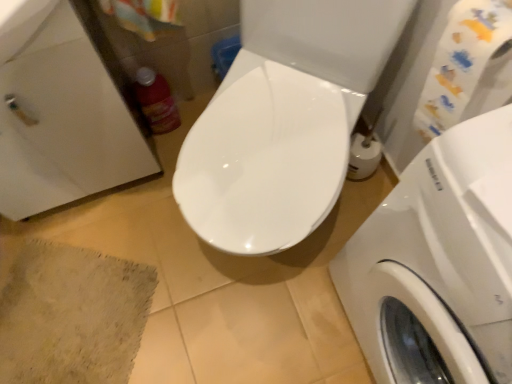
Describe the element at coordinates (72, 315) in the screenshot. The height and width of the screenshot is (384, 512). I see `beige textured bath mat at lower left` at that location.

The width and height of the screenshot is (512, 384). What do you see at coordinates (438, 263) in the screenshot?
I see `white glossy washing machine at right` at bounding box center [438, 263].

The width and height of the screenshot is (512, 384). Identify the location of matte plastic bottle at left. (156, 101).

Can you confirm if beige textured bath mat at lower left is shorter than matte plastic bottle at left?

Correct, beige textured bath mat at lower left is not as tall as matte plastic bottle at left.

Is beige textured bath mat at lower left oriented towards matte plastic bottle at left?

No, beige textured bath mat at lower left is not facing towards matte plastic bottle at left.

Looking at the image, does beige textured bath mat at lower left seem bigger or smaller compared to matte plastic bottle at left?

beige textured bath mat at lower left is bigger than matte plastic bottle at left.

Is point (59, 331) farther from camera compared to point (152, 84)?

No, it is not.

From a real-world perspective, is matte plastic bottle at left physically located above or below white glossy sink at upper left?

Clearly, from a real-world perspective, matte plastic bottle at left is below white glossy sink at upper left.

Is matte plastic bottle at left at the right side of white glossy sink at upper left?

Yes.

Is matte plastic bottle at left further to camera compared to white glossy sink at upper left?

Yes, matte plastic bottle at left is behind white glossy sink at upper left.

Is white glossy sink at upper left completely or partially inside matte plastic bottle at left?

No, white glossy sink at upper left is not a part of matte plastic bottle at left.

From the image's perspective, is matte plastic bottle at left above or below white glossy washing machine at right?

Clearly, from the image's perspective, matte plastic bottle at left is above white glossy washing machine at right.

From a real-world perspective, between matte plastic bottle at left and white glossy washing machine at right, who is vertically lower?

matte plastic bottle at left.

How far apart are matte plastic bottle at left and white glossy washing machine at right?

They are 32.87 inches apart.

Is matte plastic bottle at left looking in the opposite direction of white glossy washing machine at right?

No, matte plastic bottle at left is not facing the opposite direction of white glossy washing machine at right.

Between white glossy washing machine at right and matte plastic bottle at left, which one has larger size?

white glossy washing machine at right.

Is point (500, 195) behind point (148, 104)?

No, (500, 195) is closer to viewer.

Considering the sizes of white glossy washing machine at right and matte plastic bottle at left in the image, is white glossy washing machine at right taller or shorter than matte plastic bottle at left?

In the image, white glossy washing machine at right appears to be taller than matte plastic bottle at left.

Would you say white glossy washing machine at right is inside or outside matte plastic bottle at left?

white glossy washing machine at right is spatially situated outside matte plastic bottle at left.

Is white glossy sink at upper left oriented away from matte plastic bottle at left?

That's not correct — white glossy sink at upper left is not looking away from matte plastic bottle at left.

Considering the sizes of white glossy sink at upper left and matte plastic bottle at left in the image, is white glossy sink at upper left bigger or smaller than matte plastic bottle at left?

In the image, white glossy sink at upper left appears to be larger than matte plastic bottle at left.

Which object is positioned more to the right, white glossy sink at upper left or matte plastic bottle at left?

matte plastic bottle at left.

Would you say white glossy sink at upper left is a long distance from matte plastic bottle at left?

No, white glossy sink at upper left is not far away from matte plastic bottle at left.

Is matte plastic bottle at left spatially inside beige textured bath mat at lower left, or outside of it?

matte plastic bottle at left cannot be found inside beige textured bath mat at lower left.

Considering the relative sizes of matte plastic bottle at left and beige textured bath mat at lower left in the image provided, is matte plastic bottle at left smaller than beige textured bath mat at lower left?

Indeed, matte plastic bottle at left has a smaller size compared to beige textured bath mat at lower left.

Is matte plastic bottle at left oriented towards beige textured bath mat at lower left?

No, matte plastic bottle at left is not aimed at beige textured bath mat at lower left.

Does point (57, 71) lie behind point (77, 264)?

No, (57, 71) is closer to viewer.

From a real-world perspective, is white glossy sink at upper left located higher than beige textured bath mat at lower left?

Correct, in the physical world, white glossy sink at upper left is higher than beige textured bath mat at lower left.

Is white glossy sink at upper left next to beige textured bath mat at lower left?

No, white glossy sink at upper left is not touching beige textured bath mat at lower left.

Locate an element on the screen. This screenshot has height=384, width=512. bath mat below the matte plastic bottle at left (from the image's perspective) is located at coordinates (72, 315).

I want to click on sink to the left of matte plastic bottle at left, so click(x=62, y=113).

Looking at the image, which one is located closer to beige textured bath mat at lower left, matte plastic bottle at left or white glossy sink at upper left?

Among the two, white glossy sink at upper left is located nearer to beige textured bath mat at lower left.

Looking at the image, which one is located further to matte plastic bottle at left, white glossy sink at upper left or white glossy washing machine at right?

white glossy washing machine at right.

From the image, which object appears to be farther from matte plastic bottle at left, white glossy sink at upper left or beige textured bath mat at lower left?

beige textured bath mat at lower left is further to matte plastic bottle at left.

Which object lies nearer to the anchor point white glossy washing machine at right, white glossy sink at upper left or matte plastic bottle at left?

white glossy sink at upper left lies closer to white glossy washing machine at right than the other object.

Looking at this image, looking at the image, which one is located closer to white glossy washing machine at right, beige textured bath mat at lower left or matte plastic bottle at left?

beige textured bath mat at lower left is closer to white glossy washing machine at right.

Considering their positions, is white glossy washing machine at right positioned further to beige textured bath mat at lower left than white glossy sink at upper left?

Based on the image, white glossy washing machine at right appears to be further to beige textured bath mat at lower left.

Looking at the image, which one is located closer to beige textured bath mat at lower left, matte plastic bottle at left or white glossy washing machine at right?

matte plastic bottle at left.

When comparing their distances from white glossy washing machine at right, does matte plastic bottle at left or white glossy sink at upper left seem closer?

white glossy sink at upper left lies closer to white glossy washing machine at right than the other object.

You are a GUI agent. You are given a task and a screenshot of the screen. Output one action in this format:
    pyautogui.click(x=<x>, y=<y>)
    Task: Click on the sink between matte plastic bottle at left and beige textured bath mat at lower left in the vertical direction
    
    Given the screenshot: What is the action you would take?
    pyautogui.click(x=62, y=113)

Where is `cleaning product between white glossy sink at upper left and white glossy washing machine at right from left to right`? cleaning product between white glossy sink at upper left and white glossy washing machine at right from left to right is located at coordinates (156, 101).

This screenshot has height=384, width=512. In order to click on sink between beige textured bath mat at lower left and white glossy washing machine at right from left to right in this screenshot , I will do `click(62, 113)`.

The image size is (512, 384). Find the location of `cleaning product situated between beige textured bath mat at lower left and white glossy washing machine at right from left to right`. cleaning product situated between beige textured bath mat at lower left and white glossy washing machine at right from left to right is located at coordinates (156, 101).